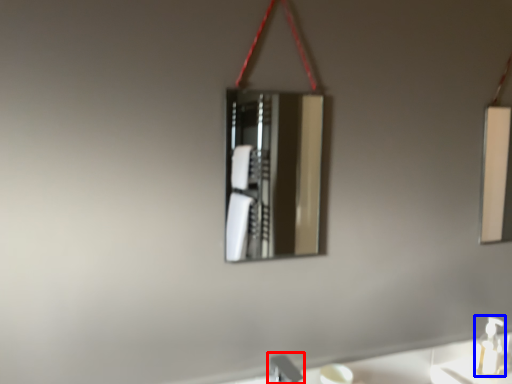
Question: Which of the following is the closest to the observer, faucet (highlighted by a red box) or soap dispenser (highlighted by a blue box)?

Choices:
 (A) faucet
 (B) soap dispenser

Answer: (A)